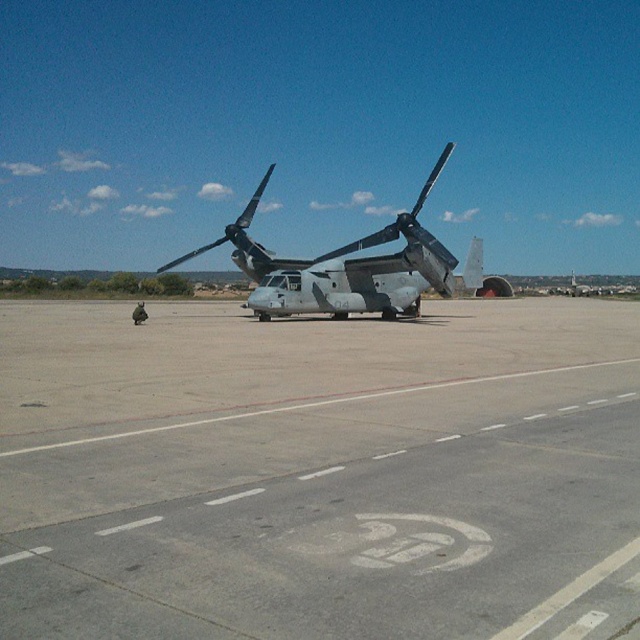
You are a maintenance worker on the tarmac. You need to inspect both the gray concrete tarmac at center and the camouflage fabric propeller at center. Which object is located below the other?

The gray concrete tarmac at center is positioned under the camouflage fabric propeller at center, so the tarmac is below the propeller.

You are a maintenance technician inspecting a military aircraft. You need to determine which part is bigger between the camouflage fabric helicopter at center and the camouflage fabric propeller at center. Which one is larger?

The camouflage fabric helicopter at center is larger than the camouflage fabric propeller at center according to the description.